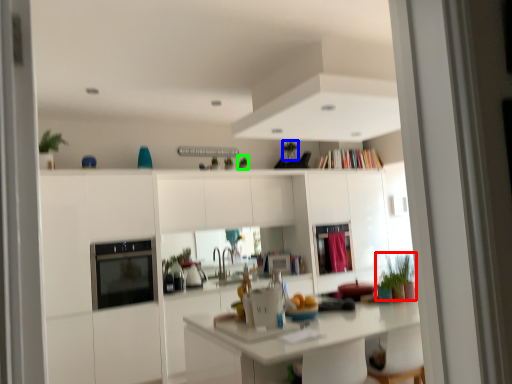
Question: Estimate the real-world distances between objects in this image. Which object is farther from plant (highlighted by a red box), plant (highlighted by a blue box) or plant (highlighted by a green box)?

Choices:
 (A) plant
 (B) plant

Answer: (A)